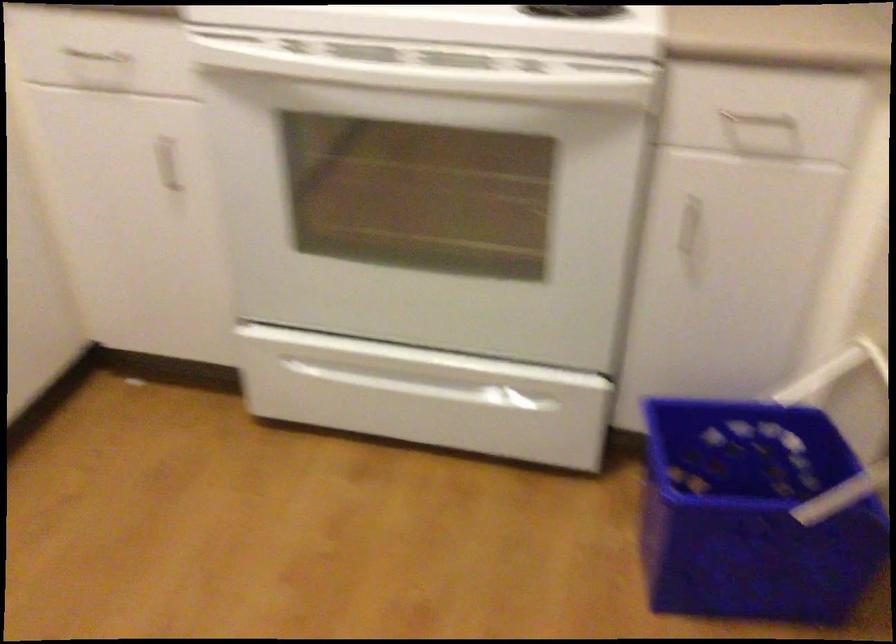
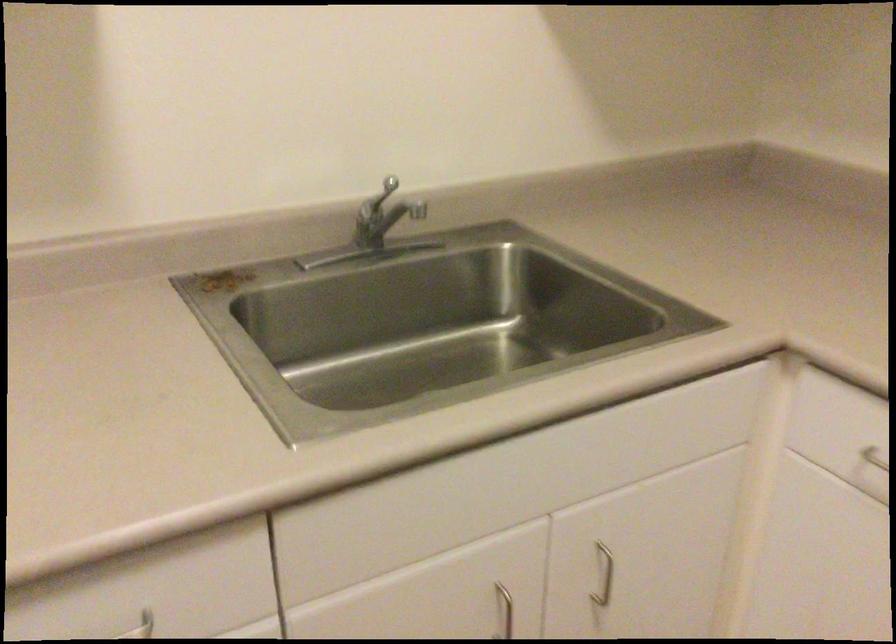
Question: The first image is from the beginning of the video and the second image is from the end. How did the camera likely rotate when shooting the video?

Choices:
 (A) Left
 (B) Right
 (C) Up
 (D) Down

Answer: (A)